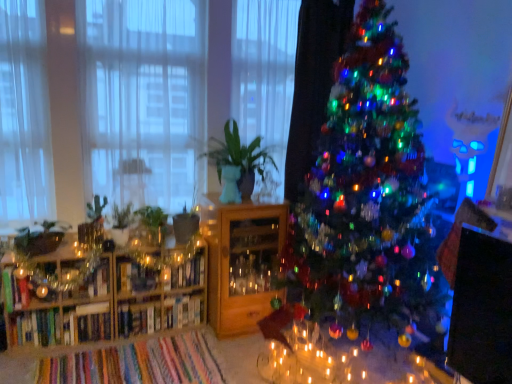
Question: From the image's perspective, is white sheer curtain at left, placed as the second curtain when sorted from left to right, below green matte plant at left, the second plant from the left?

Choices:
 (A) yes
 (B) no

Answer: (B)

Question: Is white sheer curtain at left, the 2th curtain from the right, to the left of green matte plant at left, the first plant positioned from the right, from the viewer's perspective?

Choices:
 (A) no
 (B) yes

Answer: (A)

Question: Does white sheer curtain at left, placed as the second curtain when sorted from left to right, have a smaller size compared to green matte plant at left, the second plant from the left?

Choices:
 (A) no
 (B) yes

Answer: (A)

Question: Is white sheer curtain at left, placed as the second curtain when sorted from left to right, behind green matte plant at left, the first plant positioned from the right?

Choices:
 (A) yes
 (B) no

Answer: (B)

Question: Can we say white sheer curtain at left, the 2th curtain from the right, lies outside green matte plant at left, the second plant from the left?

Choices:
 (A) yes
 (B) no

Answer: (A)

Question: Based on their positions, is green matte plant at left, the second plant from the left, located to the left or right of hardcover book at center, which is the 2th book from right to left?

Choices:
 (A) left
 (B) right

Answer: (A)

Question: Is green matte plant at left, the second plant from the left, bigger or smaller than hardcover book at center, positioned as the 1th book in left-to-right order?

Choices:
 (A) big
 (B) small

Answer: (B)

Question: Relative to hardcover book at center, which is the 2th book from right to left, is green matte plant at left, the first plant positioned from the right, in front or behind?

Choices:
 (A) front
 (B) behind

Answer: (A)

Question: Is green matte plant at left, the second plant from the left, taller or shorter than hardcover book at center, positioned as the 1th book in left-to-right order?

Choices:
 (A) tall
 (B) short

Answer: (A)

Question: From the image's perspective, relative to white sheer curtain at left, placed as the third curtain when sorted from right to left, is wooden cabinet at center, which ranks as the second shelf in left-to-right order, above or below?

Choices:
 (A) below
 (B) above

Answer: (A)

Question: Considering their positions, is wooden cabinet at center, the 1th shelf viewed from the right, located in front of or behind white sheer curtain at left, positioned as the 1th curtain in left-to-right order?

Choices:
 (A) behind
 (B) front

Answer: (A)

Question: From a real-world perspective, is wooden cabinet at center, the 1th shelf viewed from the right, above or below white sheer curtain at left, positioned as the 1th curtain in left-to-right order?

Choices:
 (A) below
 (B) above

Answer: (A)

Question: Is wooden cabinet at center, the 1th shelf viewed from the right, taller or shorter than white sheer curtain at left, placed as the third curtain when sorted from right to left?

Choices:
 (A) short
 (B) tall

Answer: (A)

Question: From the image's perspective, is green matte plant at center above or below metallic glass shelf at left, which is the 1th shelf in left-to-right order?

Choices:
 (A) below
 (B) above

Answer: (B)

Question: In the image, is green matte plant at center on the left side or the right side of metallic glass shelf at left, which is the 1th shelf in left-to-right order?

Choices:
 (A) right
 (B) left

Answer: (A)